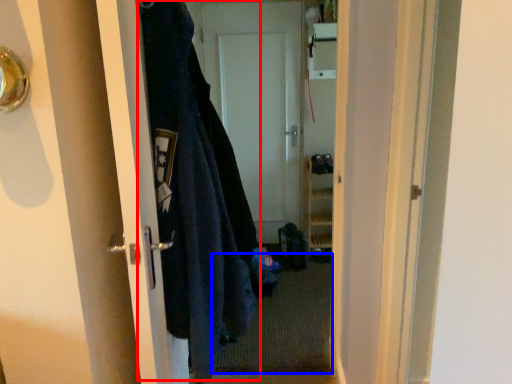
Question: Which point is closer to the camera, garment (highlighted by a red box) or doormat (highlighted by a blue box)?

Choices:
 (A) garment
 (B) doormat

Answer: (A)